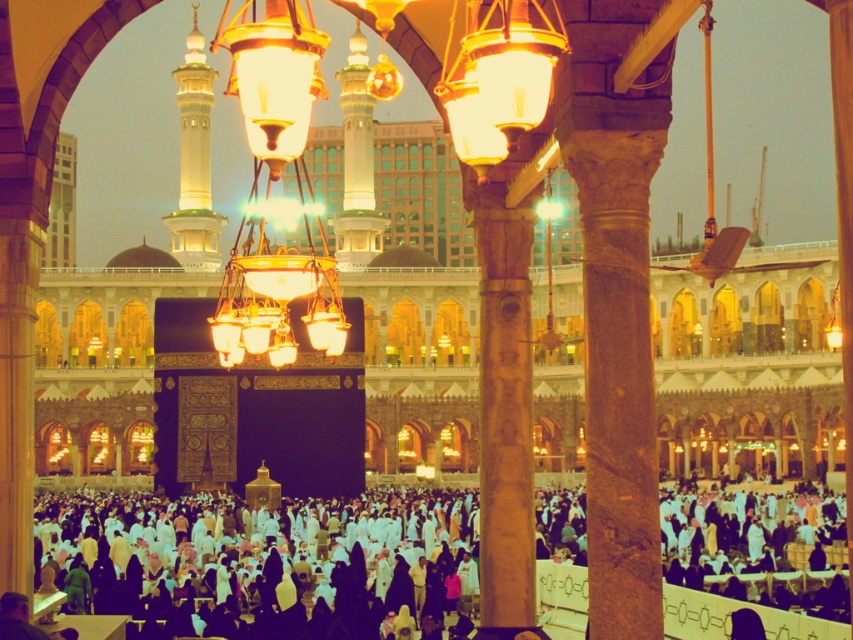
From the picture: Is white matte crowd at center to the left of wooden carved column at center from the viewer's perspective?

In fact, white matte crowd at center is to the right of wooden carved column at center.

This screenshot has width=853, height=640. What do you see at coordinates (276, 561) in the screenshot?
I see `white matte crowd at center` at bounding box center [276, 561].

Is point (782, 634) positioned after point (521, 324)?

Yes, point (782, 634) is behind point (521, 324).

In order to click on white matte crowd at center in this screenshot , I will do `click(276, 561)`.

Locate an element on the screen. white matte crowd at center is located at coordinates (276, 561).

Does white matte crowd at center appear over gold metallic chandelier at center?

Actually, white matte crowd at center is below gold metallic chandelier at center.

Does point (430, 525) lie behind point (229, 348)?

Yes, it is.

This screenshot has height=640, width=853. I want to click on white matte crowd at center, so click(276, 561).

Is wooden carved column at center thinner than gold metallic chandelier at center?

Yes, wooden carved column at center is thinner than gold metallic chandelier at center.

Does wooden carved column at center have a greater width compared to gold metallic chandelier at center?

No, wooden carved column at center is not wider than gold metallic chandelier at center.

You are a GUI agent. You are given a task and a screenshot of the screen. Output one action in this format:
    pyautogui.click(x=<x>, y=<y>)
    Task: Click on the wooden carved column at center
    
    Given the screenshot: What is the action you would take?
    pyautogui.click(x=503, y=410)

Locate an element on the screen. Image resolution: width=853 pixels, height=640 pixels. wooden carved column at center is located at coordinates (503, 410).